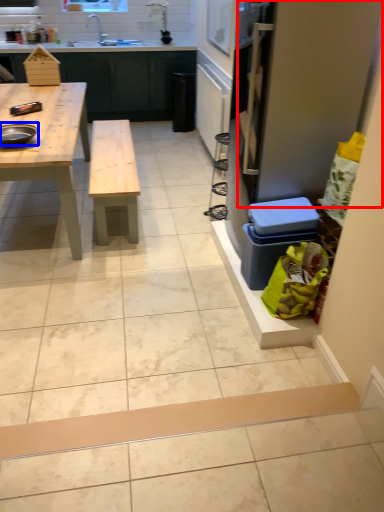
Question: Among these objects, which one is nearest to the camera, screen door (highlighted by a red box) or appliance (highlighted by a blue box)?

Choices:
 (A) screen door
 (B) appliance

Answer: (A)